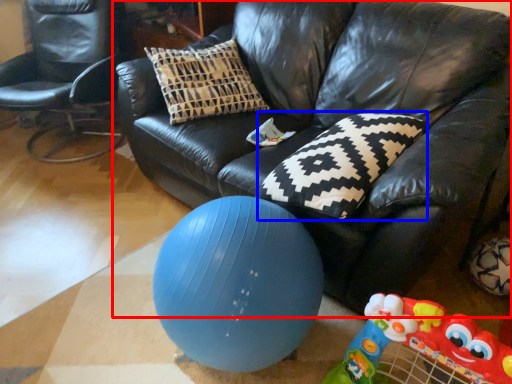
Question: Which object is closer to the camera taking this photo, studio couch (highlighted by a red box) or pillow (highlighted by a blue box)?

Choices:
 (A) studio couch
 (B) pillow

Answer: (A)